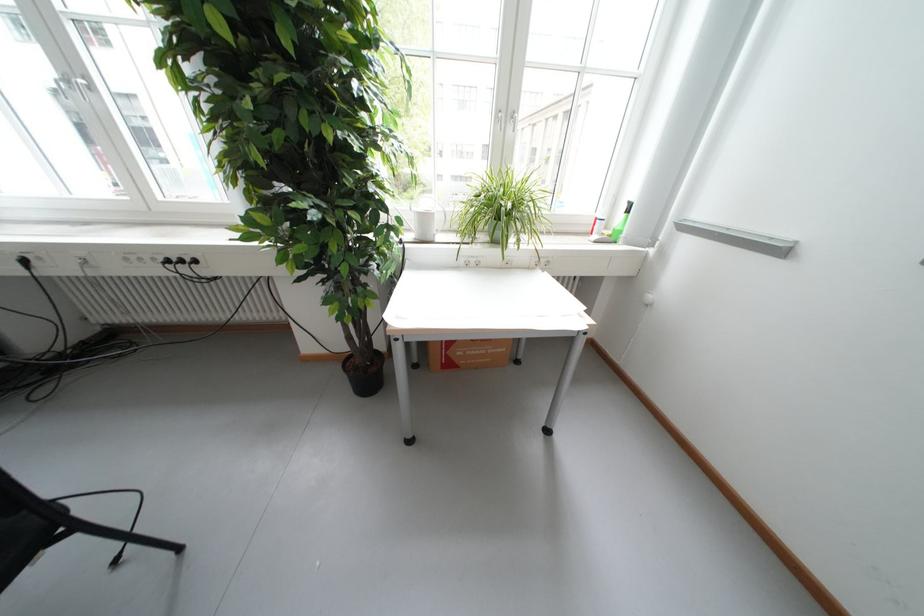
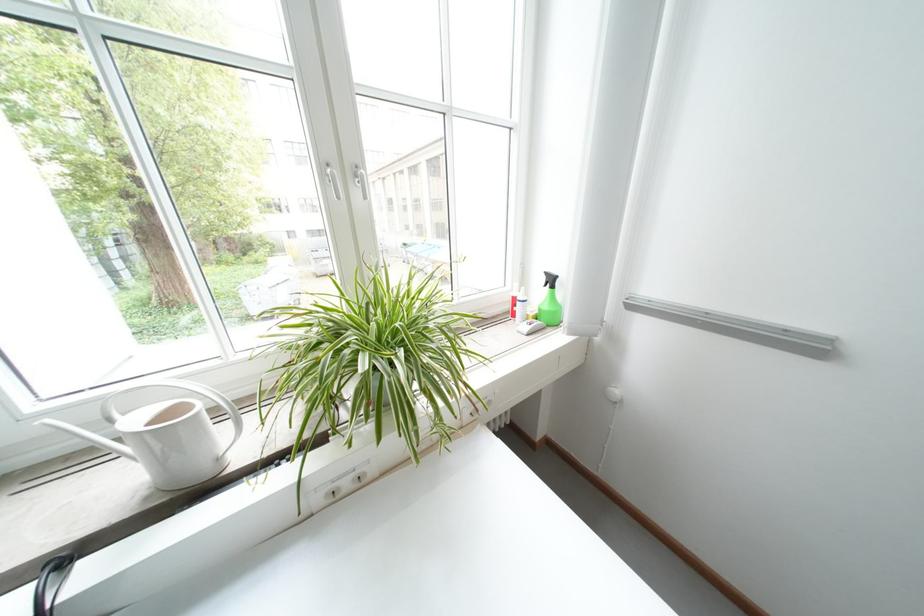
Where in the second image is the point corresponding to (506,119) from the first image?

(333, 175)